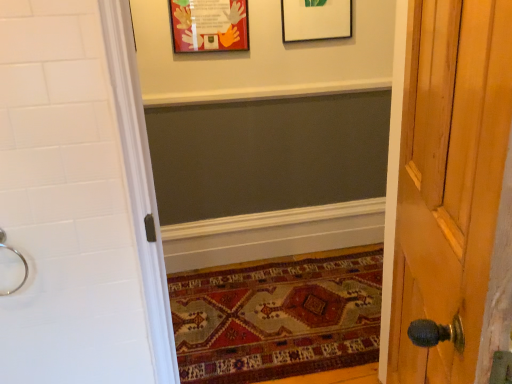
Question: From the image's perspective, does silver metallic ring at left appear lower than white matte picture frame at upper center, which is the second picture frame from left to right?

Choices:
 (A) no
 (B) yes

Answer: (B)

Question: Is silver metallic ring at left closer to camera compared to white matte picture frame at upper center, which ranks as the 1th picture frame in right-to-left order?

Choices:
 (A) yes
 (B) no

Answer: (A)

Question: Considering the relative sizes of silver metallic ring at left and white matte picture frame at upper center, which ranks as the 1th picture frame in right-to-left order, in the image provided, is silver metallic ring at left shorter than white matte picture frame at upper center, which ranks as the 1th picture frame in right-to-left order,?

Choices:
 (A) no
 (B) yes

Answer: (B)

Question: From the image's perspective, does silver metallic ring at left appear higher than white matte picture frame at upper center, which ranks as the 1th picture frame in right-to-left order?

Choices:
 (A) yes
 (B) no

Answer: (B)

Question: From a real-world perspective, does silver metallic ring at left stand above white matte picture frame at upper center, which is the second picture frame from left to right?

Choices:
 (A) no
 (B) yes

Answer: (A)

Question: Is white matte picture frame at upper center, which ranks as the 1th picture frame in right-to-left order, inside the boundaries of matte cardboard picture frame at upper center, the first picture frame positioned from the left, or outside?

Choices:
 (A) inside
 (B) outside

Answer: (B)

Question: From a real-world perspective, is white matte picture frame at upper center, which is the second picture frame from left to right, physically located above or below matte cardboard picture frame at upper center, the first picture frame positioned from the left?

Choices:
 (A) above
 (B) below

Answer: (A)

Question: In terms of height, does white matte picture frame at upper center, which is the second picture frame from left to right, look taller or shorter compared to matte cardboard picture frame at upper center, acting as the second picture frame starting from the right?

Choices:
 (A) short
 (B) tall

Answer: (A)

Question: From the image's perspective, is white matte picture frame at upper center, which is the second picture frame from left to right, positioned above or below matte cardboard picture frame at upper center, acting as the second picture frame starting from the right?

Choices:
 (A) above
 (B) below

Answer: (A)

Question: From the image's perspective, is silver metallic ring at left positioned above or below carpeted mat at lower center?

Choices:
 (A) above
 (B) below

Answer: (A)

Question: From a real-world perspective, is silver metallic ring at left above or below carpeted mat at lower center?

Choices:
 (A) above
 (B) below

Answer: (A)

Question: Visually, is silver metallic ring at left positioned to the left or to the right of carpeted mat at lower center?

Choices:
 (A) right
 (B) left

Answer: (B)

Question: Considering their positions, is silver metallic ring at left located in front of or behind carpeted mat at lower center?

Choices:
 (A) front
 (B) behind

Answer: (A)

Question: In terms of height, does white matte picture frame at upper center, which is the second picture frame from left to right, look taller or shorter compared to silver metallic ring at left?

Choices:
 (A) tall
 (B) short

Answer: (A)

Question: Does point (297, 36) appear closer or farther from the camera than point (22, 258)?

Choices:
 (A) closer
 (B) farther

Answer: (B)